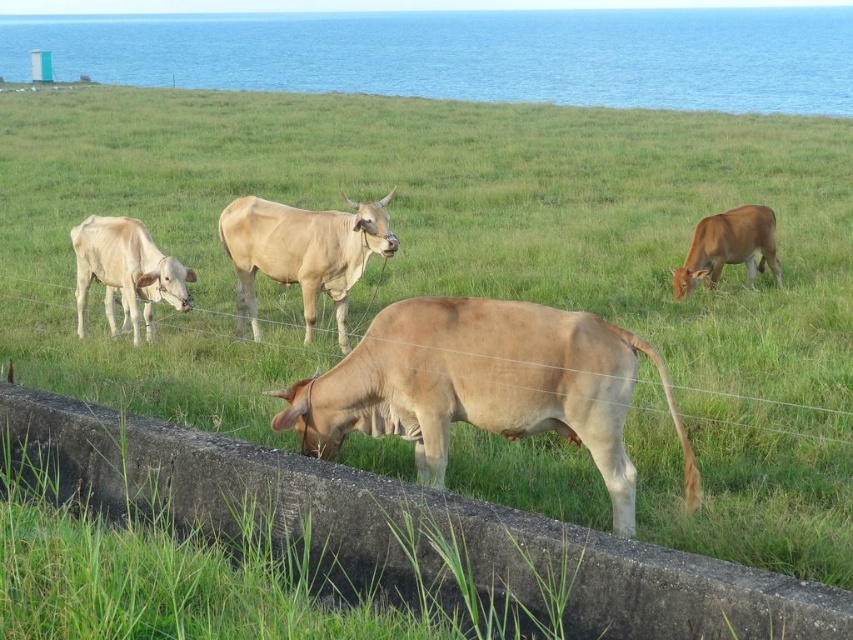
You are a GUI agent. You are given a task and a screenshot of the screen. Output one action in this format:
    pyautogui.click(x=<x>, y=<y>)
    Task: Click on the light brown smooth cow at center
    Image resolution: width=853 pixels, height=640 pixels.
    Given the screenshot: What is the action you would take?
    pyautogui.click(x=485, y=387)

Image resolution: width=853 pixels, height=640 pixels. Describe the element at coordinates (485, 387) in the screenshot. I see `light brown smooth cow at center` at that location.

The image size is (853, 640). What are the coordinates of `light brown smooth cow at center` in the screenshot? It's located at (485, 387).

Is point (103, 278) less distant than point (680, 282)?

Yes.

Which is below, light beige cow at left or light brown cow at right?

light beige cow at left is below.

Does point (83, 316) come behind point (741, 259)?

No, (83, 316) is closer to viewer.

Where is `light beige cow at left`? This screenshot has width=853, height=640. light beige cow at left is located at coordinates (126, 273).

Who is more distant from viewer, (281,86) or (706,246)?

Point (281,86)

Does point (693, 68) lie in front of point (697, 236)?

No, it is behind (697, 236).

Where is `blue water at upper center`? The width and height of the screenshot is (853, 640). blue water at upper center is located at coordinates (473, 54).

You are a GUI agent. You are given a task and a screenshot of the screen. Output one action in this format:
    pyautogui.click(x=<x>, y=<y>)
    Task: Click on the blue water at upper center
    This screenshot has height=640, width=853.
    Given the screenshot: What is the action you would take?
    pyautogui.click(x=473, y=54)